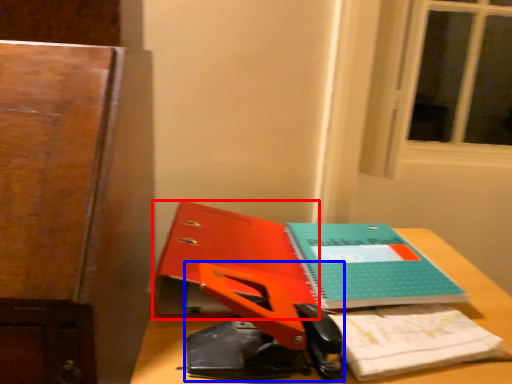
Question: Which of the following is the farthest to the observer, paperback book (highlighted by a red box) or scissors (highlighted by a blue box)?

Choices:
 (A) paperback book
 (B) scissors

Answer: (A)